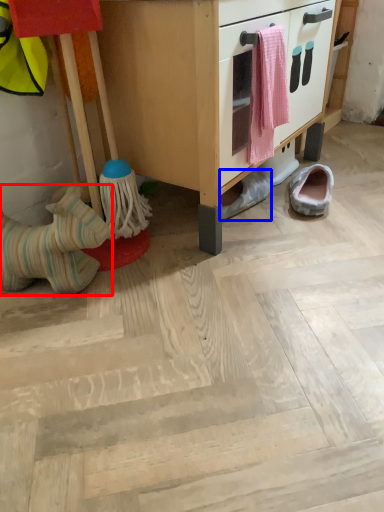
Question: Which object is further to the camera taking this photo, footwear (highlighted by a red box) or footwear (highlighted by a blue box)?

Choices:
 (A) footwear
 (B) footwear

Answer: (B)